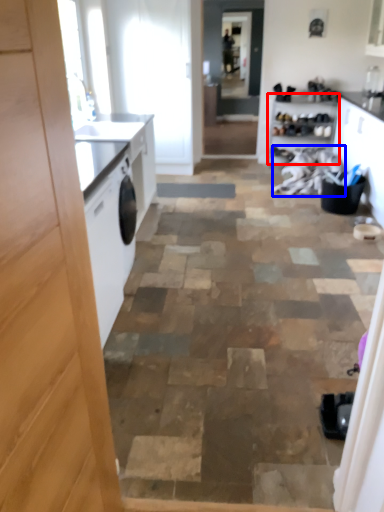
Question: Which of the following is the farthest to the observer, cabinetry (highlighted by a red box) or laundry (highlighted by a blue box)?

Choices:
 (A) cabinetry
 (B) laundry

Answer: (A)